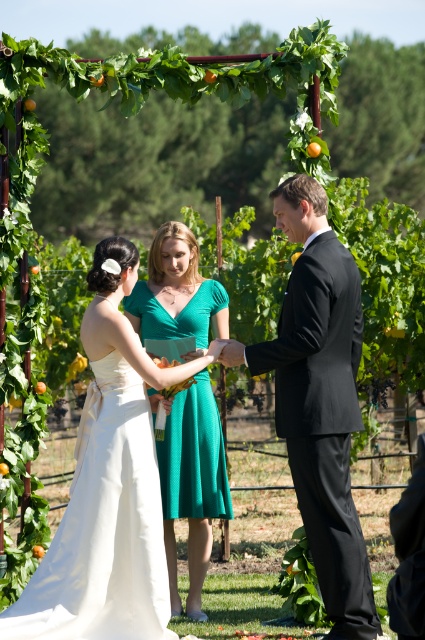
Does satin white dress at center have a smaller size compared to black satin suit at center?

No.

Does satin white dress at center appear on the right side of black satin suit at center?

No, satin white dress at center is not to the right of black satin suit at center.

Who is more distant from viewer, [108,605] or [300,228]?

The point [108,605] is more distant.

The image size is (425, 640). I want to click on satin white dress at center, so click(x=108, y=484).

From the picture: Between satin white dress at center and emerald green satin dress at center, which one has less height?

satin white dress at center

Between satin white dress at center and emerald green satin dress at center, which one appears on the right side from the viewer's perspective?

emerald green satin dress at center is more to the right.

The height and width of the screenshot is (640, 425). Find the location of `satin white dress at center`. satin white dress at center is located at coordinates (108, 484).

In order to click on satin white dress at center in this screenshot , I will do `click(108, 484)`.

Is black satin suit at center to the right of emerald green satin dress at center from the viewer's perspective?

Indeed, black satin suit at center is positioned on the right side of emerald green satin dress at center.

Which is below, black satin suit at center or emerald green satin dress at center?

emerald green satin dress at center is lower down.

Does point (331, 547) come in front of point (212, 472)?

Yes, point (331, 547) is closer to viewer.

Find the location of a particular element. The image size is (425, 640). black satin suit at center is located at coordinates (320, 400).